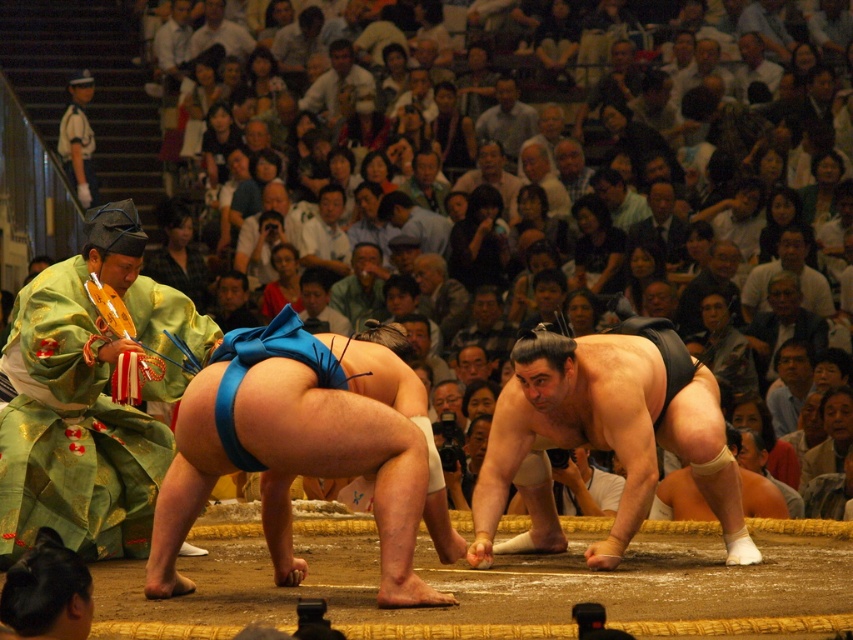
Is green silk kimono at left taller than dark gray hair at center?

Indeed, green silk kimono at left has a greater height compared to dark gray hair at center.

The width and height of the screenshot is (853, 640). Describe the element at coordinates (91, 394) in the screenshot. I see `green silk kimono at left` at that location.

The image size is (853, 640). What are the coordinates of `green silk kimono at left` in the screenshot? It's located at 91,394.

Can you confirm if blue fabric sumo at center is smaller than white uniform at upper left?

Actually, blue fabric sumo at center might be larger than white uniform at upper left.

Between blue fabric sumo at center and white uniform at upper left, which one appears on the left side from the viewer's perspective?

white uniform at upper left

Measure the distance between point (318, 420) and camera.

A distance of 12.57 meters exists between point (318, 420) and camera.

At what (x,y) coordinates should I click in order to perform the action: click on blue fabric sumo at center. Please return your answer as a coordinate pair (x, y). This screenshot has width=853, height=640. Looking at the image, I should click on (305, 449).

Does blue fabric sumo at center have a greater width compared to black matte sumo wrestler at center?

In fact, blue fabric sumo at center might be narrower than black matte sumo wrestler at center.

In the scene shown: Does blue fabric sumo at center come in front of black matte sumo wrestler at center?

That is True.

Where is `blue fabric sumo at center`? This screenshot has height=640, width=853. blue fabric sumo at center is located at coordinates (305, 449).